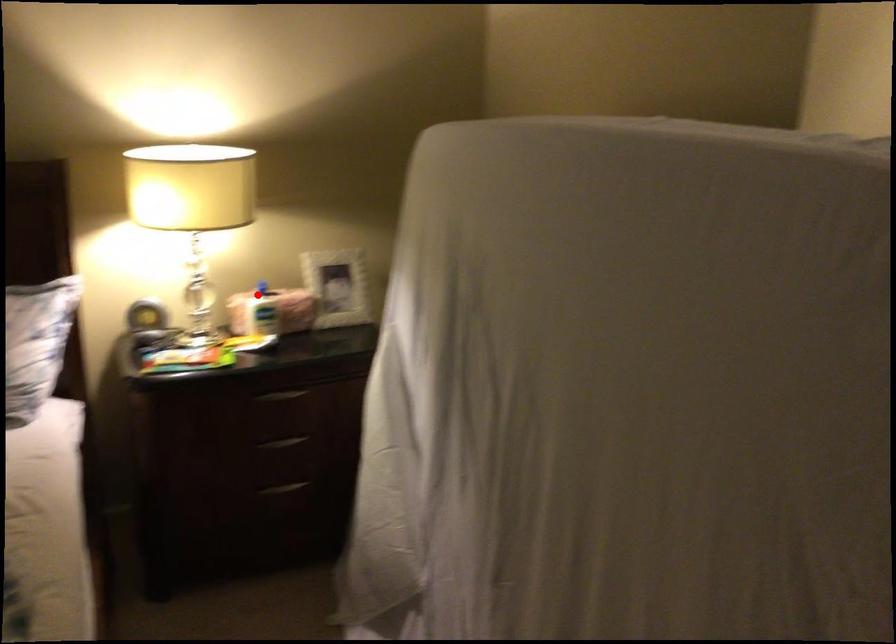
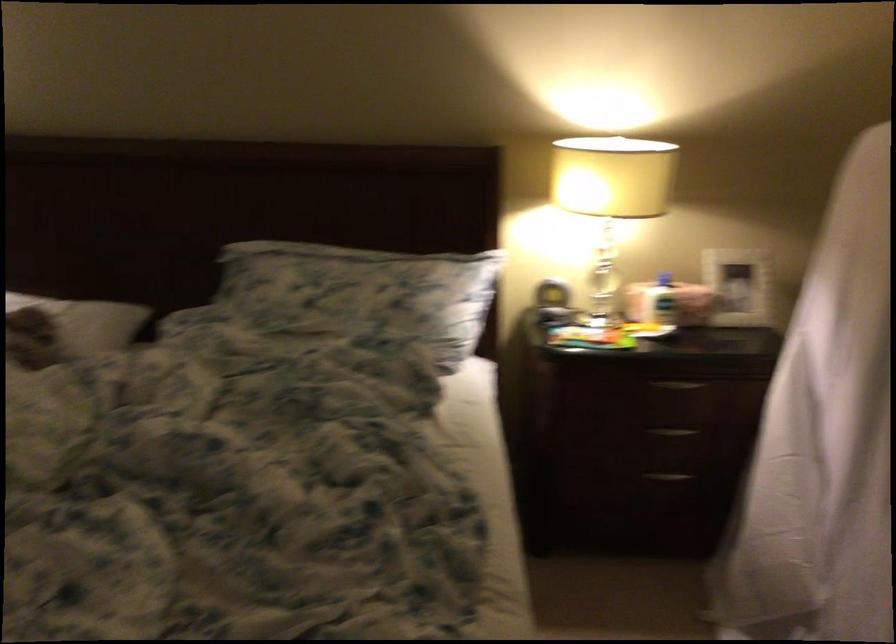
Where in the second image is the point corresponding to the highlighted location from the first image?

(664, 279)